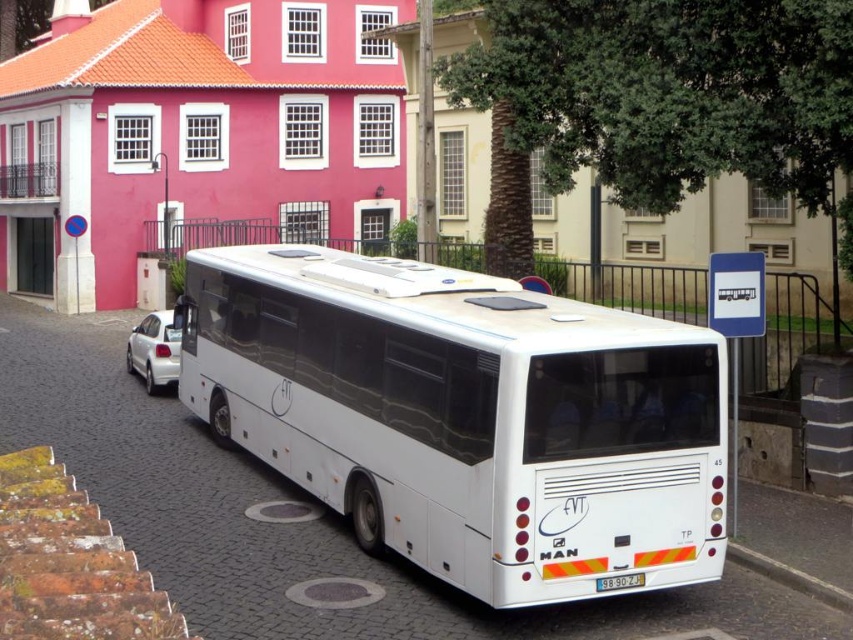
Question: Is white matte bus at center further to camera compared to gray concrete curb at lower right?

Choices:
 (A) yes
 (B) no

Answer: (B)

Question: Which point is closer to the camera?

Choices:
 (A) white plastic license plate at rear
 (B) white glossy car at lower left

Answer: (A)

Question: Is white glossy car at lower left bigger than white plastic license plate at rear?

Choices:
 (A) no
 (B) yes

Answer: (B)

Question: Where is white matte bus at center located in relation to white plastic license plate at rear in the image?

Choices:
 (A) below
 (B) above

Answer: (B)

Question: Estimate the real-world distances between objects in this image. Which object is closer to the white glossy car at lower left?

Choices:
 (A) white matte bus at center
 (B) white plastic license plate at rear
 (C) gray concrete curb at lower right

Answer: (A)

Question: Which is nearer to the white glossy car at lower left?

Choices:
 (A) white matte bus at center
 (B) gray concrete curb at lower right

Answer: (A)